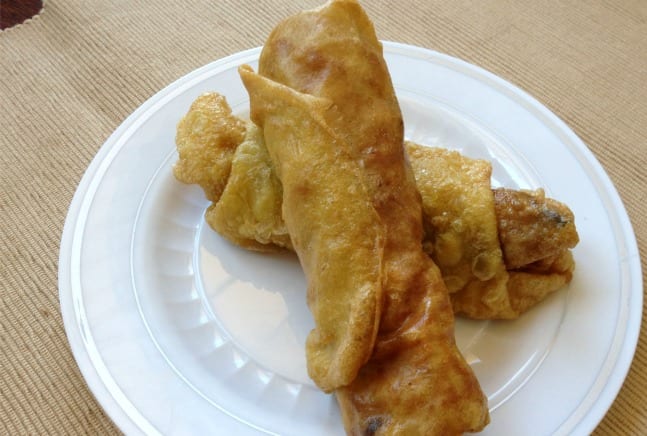
The width and height of the screenshot is (647, 436). Identify the location of table mat. (33, 128), (551, 52).